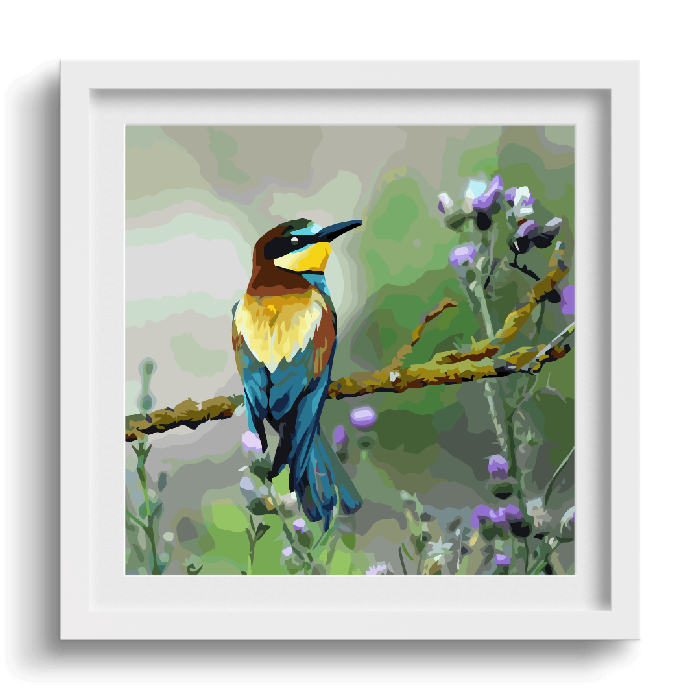
Image resolution: width=700 pixels, height=700 pixels. Identify the location of picture frame. (603, 553).